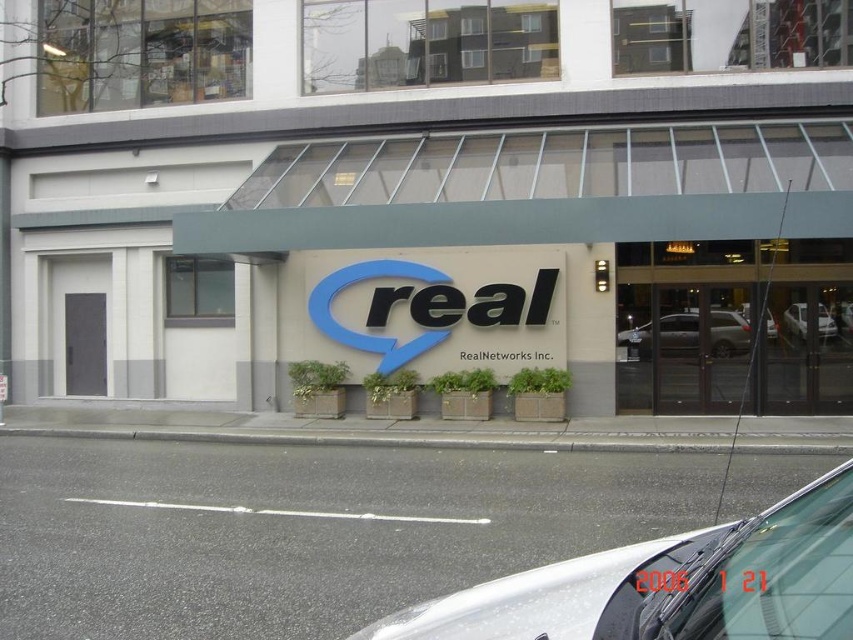
Question: Which point is farther from the camera taking this photo?

Choices:
 (A) (86, 301)
 (B) (805, 493)

Answer: (A)

Question: Which point is farther from the camera taking this photo?

Choices:
 (A) (83, 372)
 (B) (788, 321)
 (C) (802, 588)

Answer: (A)

Question: Among these objects, which one is farthest from the camera?

Choices:
 (A) silver metallic car at lower right
 (B) glass door at center
 (C) silver metallic sedan at right
 (D) silver metallic sedan at center

Answer: (D)

Question: Can you confirm if blue plastic sign at center is bigger than gray matte door at left?

Choices:
 (A) no
 (B) yes

Answer: (B)

Question: Does matte gray sign at center appear over gray matte door at left?

Choices:
 (A) no
 (B) yes

Answer: (B)

Question: Does silver metallic car at lower right appear under gray matte door at left?

Choices:
 (A) no
 (B) yes

Answer: (B)